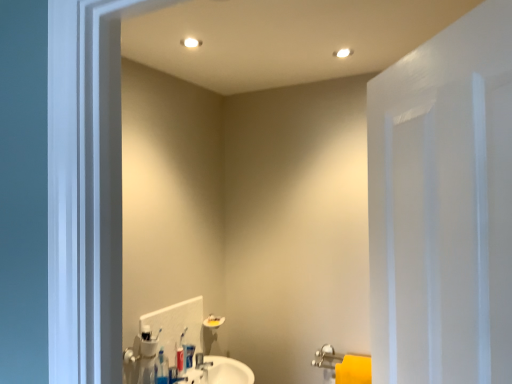
Question: Based on their positions, is white painted wood door at right located to the left or right of white plastic toothbrush at center?

Choices:
 (A) left
 (B) right

Answer: (B)

Question: From a real-world perspective, is white painted wood door at right positioned above or below white plastic toothbrush at center?

Choices:
 (A) above
 (B) below

Answer: (A)

Question: Which object is positioned closest to the matte plastic toothpaste tube at center?

Choices:
 (A) white painted wood door at right
 (B) matte silver faucet at center
 (C) white plastic toothbrush at center

Answer: (C)

Question: Which object is positioned farthest from the white painted wood door at right?

Choices:
 (A) matte silver faucet at center
 (B) matte plastic toothpaste tube at center
 (C) white plastic toothbrush at center

Answer: (A)